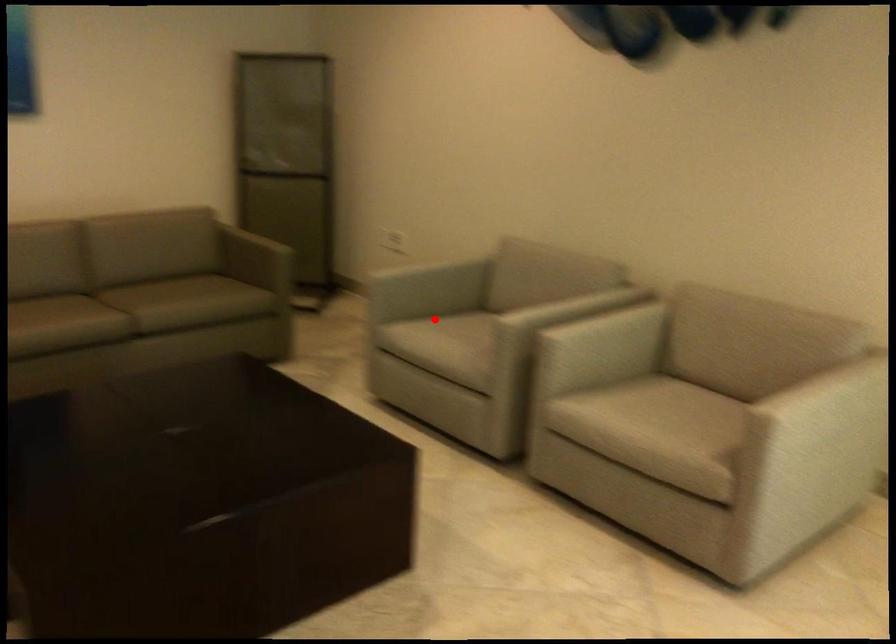
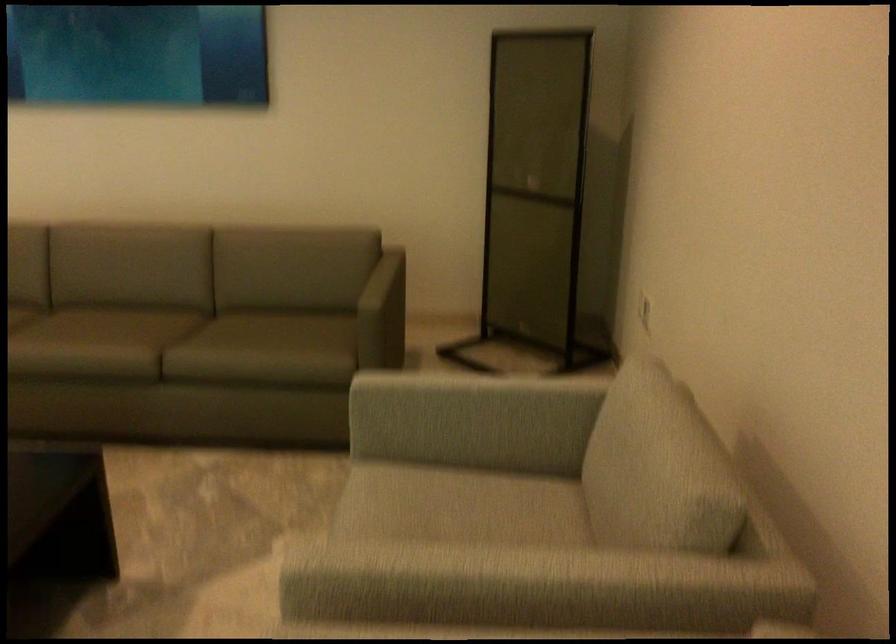
Locate, in the second image, the point that corresponds to the highlighted location in the first image.

(455, 491)